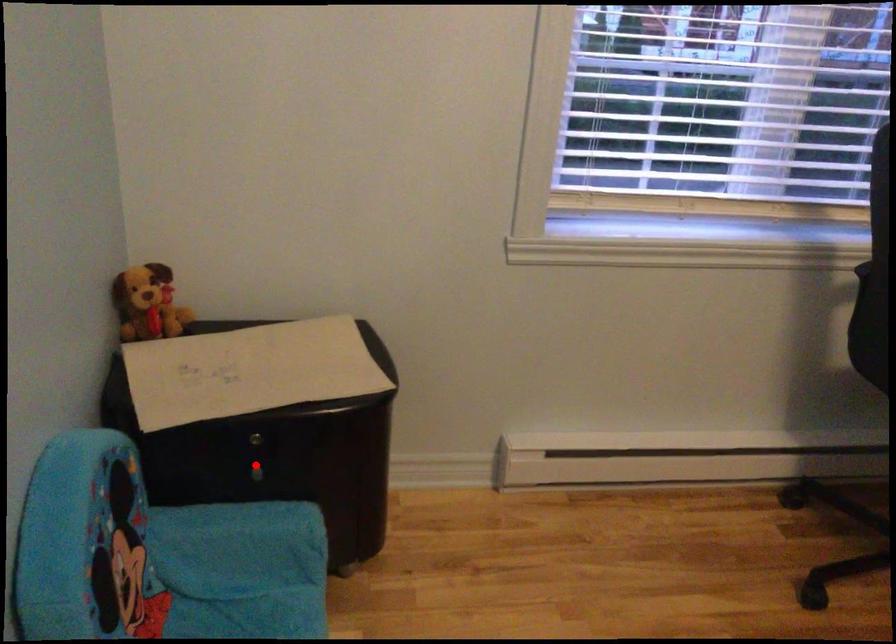
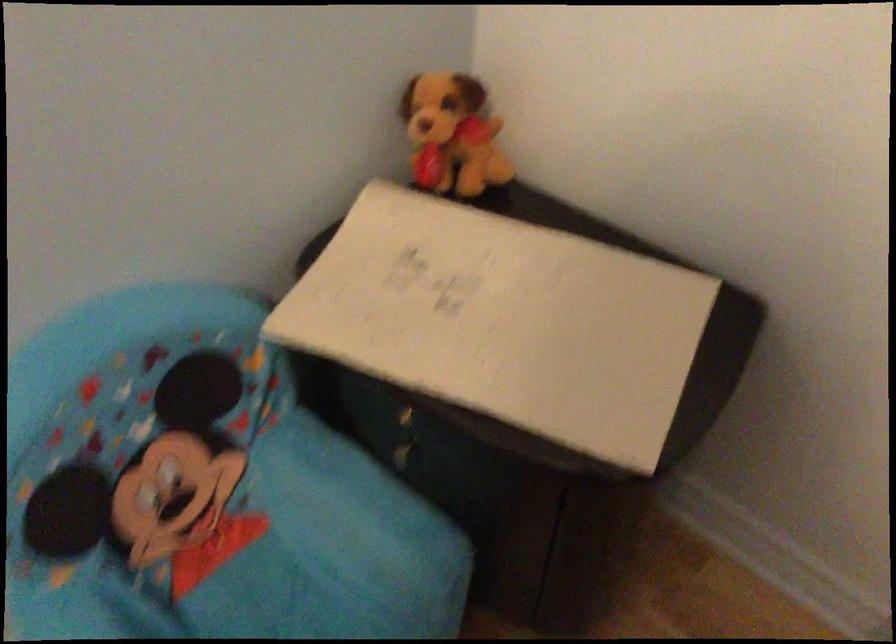
Question: I am providing you with two images of the same scene from different viewpoints. A red point is marked on the first image. At the location where the point appears in image 1, is it still visible in image 2?

Choices:
 (A) Yes
 (B) No

Answer: (A)